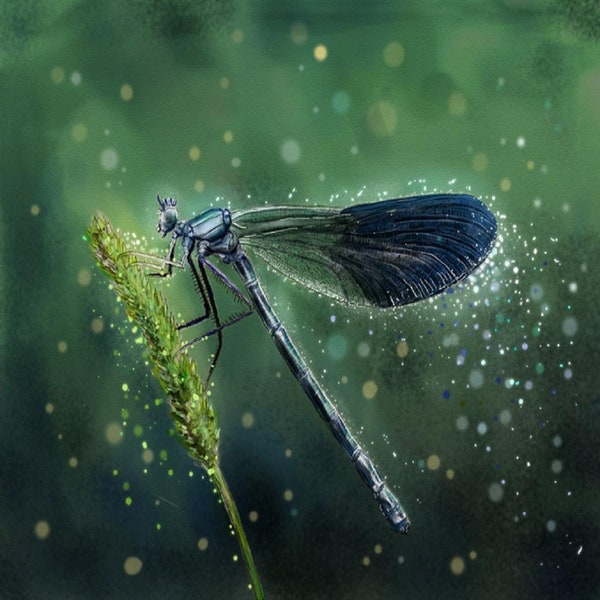
The width and height of the screenshot is (600, 600). I want to click on the left front leg, so click(x=171, y=251).